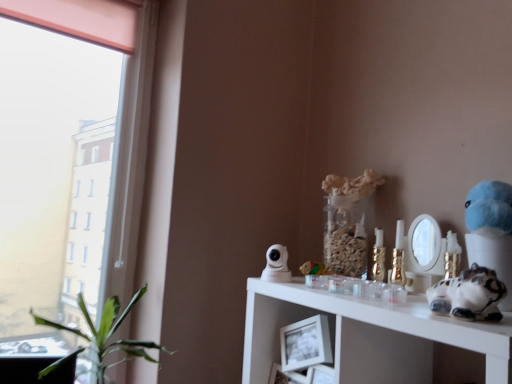
Question: Is gold metallic candle holder at upper right shorter than wooden block at center, which is counted as the 1th toy, starting from the left?

Choices:
 (A) yes
 (B) no

Answer: (B)

Question: Considering the relative sizes of gold metallic candle holder at upper right and wooden block at center, which is counted as the second toy, starting from the front, in the image provided, is gold metallic candle holder at upper right taller than wooden block at center, which is counted as the second toy, starting from the front,?

Choices:
 (A) yes
 (B) no

Answer: (A)

Question: From the image's perspective, is gold metallic candle holder at upper right on top of wooden block at center, which is the 2th toy in right-to-left order?

Choices:
 (A) yes
 (B) no

Answer: (A)

Question: Could you tell me if gold metallic candle holder at upper right is turned towards wooden block at center, the 1th toy viewed from the back?

Choices:
 (A) no
 (B) yes

Answer: (A)

Question: Is gold metallic candle holder at upper right thinner than wooden block at center, which is the 2th toy in right-to-left order?

Choices:
 (A) yes
 (B) no

Answer: (A)

Question: From a real-world perspective, relative to white glossy cat figurine at right, arranged as the second figurine when viewed from the back, is wooden block at center, which is counted as the 1th toy, starting from the left, vertically above or below?

Choices:
 (A) below
 (B) above

Answer: (A)

Question: In the image, is wooden block at center, which is the 2th toy in right-to-left order, on the left side or the right side of white glossy cat figurine at right, the second figurine viewed from the left?

Choices:
 (A) left
 (B) right

Answer: (A)

Question: Does point (314, 269) appear closer or farther from the camera than point (502, 261)?

Choices:
 (A) closer
 (B) farther

Answer: (B)

Question: Based on their sizes in the image, would you say wooden block at center, which is counted as the 1th toy, starting from the left, is bigger or smaller than white glossy cat figurine at right, arranged as the second figurine when viewed from the back?

Choices:
 (A) big
 (B) small

Answer: (B)

Question: Is green leafy plant at left taller or shorter than gold metallic candle holder at upper right?

Choices:
 (A) tall
 (B) short

Answer: (A)

Question: From the image's perspective, relative to gold metallic candle holder at upper right, is green leafy plant at left above or below?

Choices:
 (A) above
 (B) below

Answer: (B)

Question: From a real-world perspective, relative to gold metallic candle holder at upper right, is green leafy plant at left vertically above or below?

Choices:
 (A) above
 (B) below

Answer: (B)

Question: Relative to gold metallic candle holder at upper right, is green leafy plant at left in front or behind?

Choices:
 (A) front
 (B) behind

Answer: (A)

Question: From a real-world perspective, relative to green leafy plant at left, is white glossy security camera at upper center, marked as the second figurine in a right-to-left arrangement, vertically above or below?

Choices:
 (A) below
 (B) above

Answer: (B)

Question: Considering the positions of white glossy security camera at upper center, which is counted as the 2th figurine, starting from the front, and green leafy plant at left in the image, is white glossy security camera at upper center, which is counted as the 2th figurine, starting from the front, taller or shorter than green leafy plant at left?

Choices:
 (A) tall
 (B) short

Answer: (B)